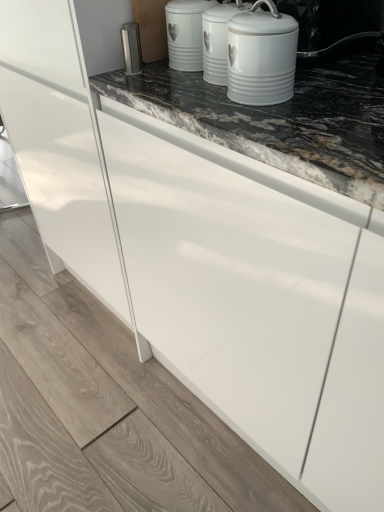
Question: Would you consider satin silver canister at upper center to be distant from white ceramic canister at upper center?

Choices:
 (A) no
 (B) yes

Answer: (A)

Question: From a real-world perspective, is satin silver canister at upper center below white ceramic canister at upper center?

Choices:
 (A) no
 (B) yes

Answer: (B)

Question: Considering the relative positions of satin silver canister at upper center and white ceramic canister at upper center in the image provided, is satin silver canister at upper center to the right of white ceramic canister at upper center from the viewer's perspective?

Choices:
 (A) yes
 (B) no

Answer: (B)

Question: Considering the relative positions of satin silver canister at upper center and white ceramic canister at upper center in the image provided, is satin silver canister at upper center to the left of white ceramic canister at upper center from the viewer's perspective?

Choices:
 (A) no
 (B) yes

Answer: (B)

Question: Can you confirm if satin silver canister at upper center is wider than white ceramic canister at upper center?

Choices:
 (A) yes
 (B) no

Answer: (B)

Question: Would you say satin silver canister at upper center is inside or outside white ceramic canister at upper center?

Choices:
 (A) inside
 (B) outside

Answer: (B)

Question: Considering the positions of satin silver canister at upper center and white ceramic canister at upper center in the image, is satin silver canister at upper center wider or thinner than white ceramic canister at upper center?

Choices:
 (A) wide
 (B) thin

Answer: (B)

Question: From their relative heights in the image, would you say satin silver canister at upper center is taller or shorter than white ceramic canister at upper center?

Choices:
 (A) short
 (B) tall

Answer: (A)

Question: From the image's perspective, is satin silver canister at upper center above or below white ceramic canister at upper center?

Choices:
 (A) above
 (B) below

Answer: (B)

Question: Would you say white ceramic canister at upper center is inside or outside satin silver canister at upper center?

Choices:
 (A) outside
 (B) inside

Answer: (A)

Question: Considering the positions of point (175, 22) and point (125, 40), is point (175, 22) closer or farther from the camera than point (125, 40)?

Choices:
 (A) farther
 (B) closer

Answer: (B)

Question: In terms of height, does white ceramic canister at upper center look taller or shorter compared to satin silver canister at upper center?

Choices:
 (A) short
 (B) tall

Answer: (B)

Question: Considering the positions of white ceramic canister at upper center and satin silver canister at upper center in the image, is white ceramic canister at upper center bigger or smaller than satin silver canister at upper center?

Choices:
 (A) small
 (B) big

Answer: (B)

Question: Considering the positions of white ceramic canister at upper center and satin silver canister at upper center in the image, is white ceramic canister at upper center taller or shorter than satin silver canister at upper center?

Choices:
 (A) tall
 (B) short

Answer: (A)

Question: Is white ceramic canister at upper center bigger or smaller than satin silver canister at upper center?

Choices:
 (A) small
 (B) big

Answer: (B)